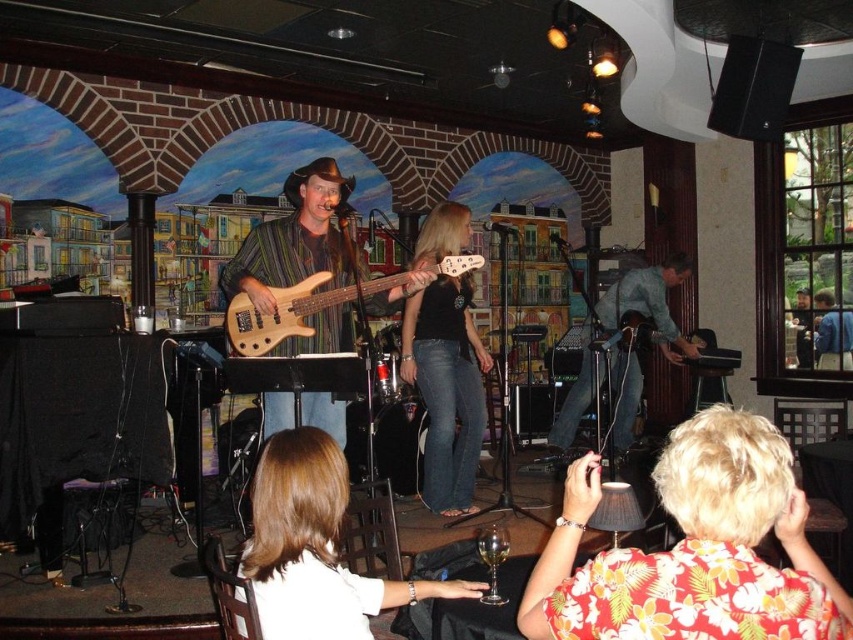
You are a photographer at the back of the venue and want to capture both the blonde hair at center and the natural wood electric bass at center in a single shot. Based on their sizes in the image, which object should you focus on to ensure both are clearly visible?

The blonde hair at center occupies less space than the natural wood electric bass at center. To ensure both are clearly visible, focus on the natural wood electric bass at center since it is larger and will remain in focus while the smaller blonde hair at center will also be within the depth of field.